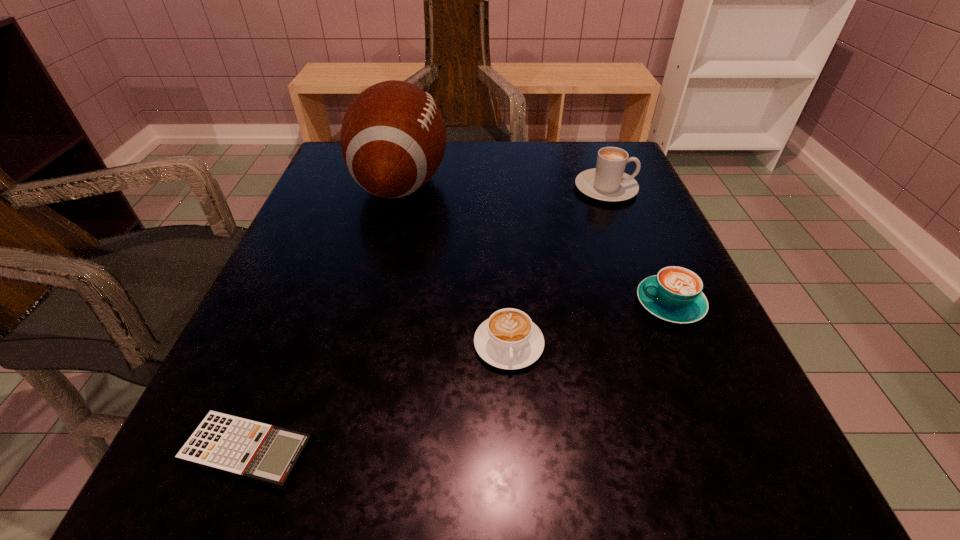
Find the location of a particular element. This screenshot has width=960, height=540. the tallest object is located at coordinates (393, 138).

Image resolution: width=960 pixels, height=540 pixels. What are the coordinates of `the tallest cappuccino` in the screenshot? It's located at pos(607,182).

At what (x,y) coordinates should I click in order to perform the action: click on the farthest cappuccino. Please return your answer as a coordinate pair (x, y). This screenshot has width=960, height=540. Looking at the image, I should click on (607, 182).

This screenshot has height=540, width=960. What are the coordinates of `the third object from left to right` in the screenshot? It's located at (509, 339).

Find the location of a particular element. This screenshot has height=540, width=960. the leftmost cappuccino is located at coordinates (509, 339).

Where is `the nearest object`? the nearest object is located at coordinates (252, 450).

You are a GUI agent. You are given a task and a screenshot of the screen. Output one action in this format:
    pyautogui.click(x=<x>, y=<y>)
    Task: Click on the shortest object
    
    Given the screenshot: What is the action you would take?
    pyautogui.click(x=252, y=450)

Find the location of a particular element. vacant space located 0.220m on the laces of the tallest object is located at coordinates (548, 183).

Identify the location of free space located 0.180m on the right of the calculator. The height and width of the screenshot is (540, 960). (461, 451).

At what (x,y) coordinates should I click in order to perform the action: click on football that is at the far edge. Please return your answer as a coordinate pair (x, y). Looking at the image, I should click on (393, 138).